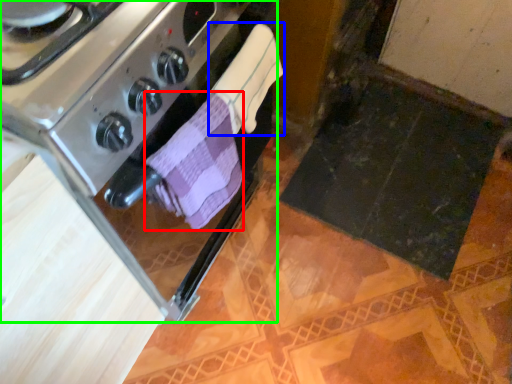
Question: Based on their relative distances, which object is nearer to bath towel (highlighted by a red box)? Choose from bath towel (highlighted by a blue box) and kitchen appliance (highlighted by a green box).

Choices:
 (A) bath towel
 (B) kitchen appliance

Answer: (A)